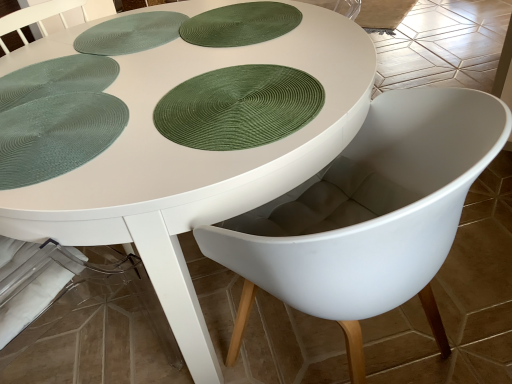
Where is `vacant area situated to the left side of green textured placemat at upper left`? Image resolution: width=512 pixels, height=384 pixels. vacant area situated to the left side of green textured placemat at upper left is located at coordinates (44, 50).